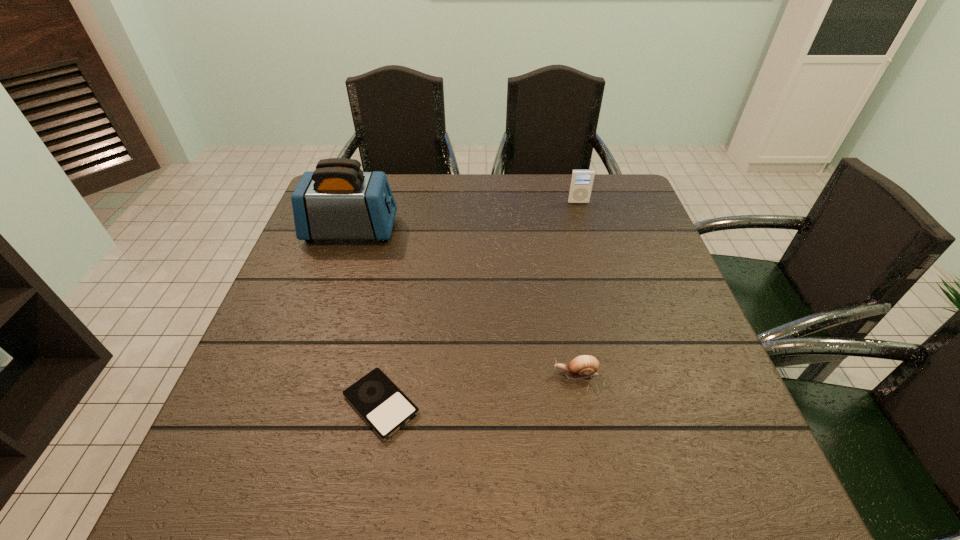
Find the location of a particular element. This screenshot has width=960, height=540. unoccupied position between the third nearest object and the taller iPod is located at coordinates (465, 217).

At what (x,y) coordinates should I click in order to perform the action: click on free space between the shorter iPod and the second farthest object. Please return your answer as a coordinate pair (x, y). Looking at the image, I should click on (367, 318).

Find the location of `blank region between the tallest object and the right iPod`. blank region between the tallest object and the right iPod is located at coordinates (465, 217).

The width and height of the screenshot is (960, 540). In order to click on vacant region between the second shortest object and the farthest object in this screenshot , I will do `click(577, 288)`.

At what (x,y) coordinates should I click in order to perform the action: click on vacant space that's between the escargot and the right iPod. Please return your answer as a coordinate pair (x, y). Looking at the image, I should click on point(577,288).

Locate which object ranks second in proximity to the tallest object. Please provide its 2D coordinates. Your answer should be formatted as a tuple, i.e. [(x, y)], where the tuple contains the x and y coordinates of a point satisfying the conditions above.

[(581, 183)]

Identify which object is located as the nearest to the escargot. Please provide its 2D coordinates. Your answer should be formatted as a tuple, i.e. [(x, y)], where the tuple contains the x and y coordinates of a point satisfying the conditions above.

[(385, 408)]

The height and width of the screenshot is (540, 960). I want to click on vacant space that satisfies the following two spatial constraints: 1. on the front-facing side of the farther iPod; 2. on the front-facing side of the toaster, so click(x=586, y=231).

Find the location of a particular element. The width and height of the screenshot is (960, 540). free space that satisfies the following two spatial constraints: 1. on the front-facing side of the tallest object; 2. on the right side of the nearer iPod is located at coordinates (293, 404).

This screenshot has width=960, height=540. I want to click on vacant space that satisfies the following two spatial constraints: 1. on the front-facing side of the rightmost object; 2. on the front-facing side of the tallest object, so click(586, 231).